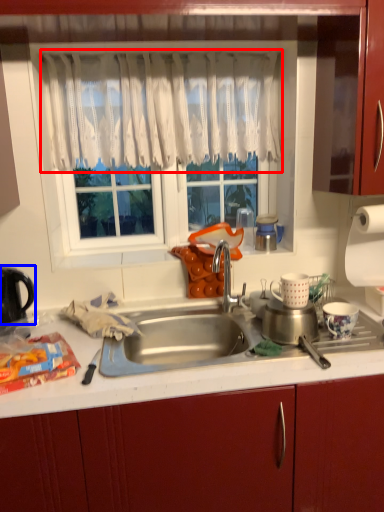
Question: Which object is further to the camera taking this photo, curtain (highlighted by a red box) or kitchen appliance (highlighted by a blue box)?

Choices:
 (A) curtain
 (B) kitchen appliance

Answer: (A)